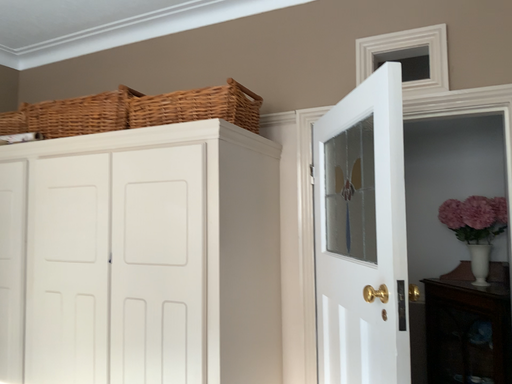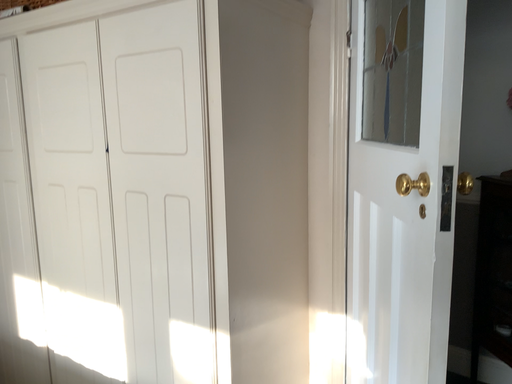
Question: How did the camera likely rotate when shooting the video?

Choices:
 (A) rotated downward
 (B) rotated upward

Answer: (A)